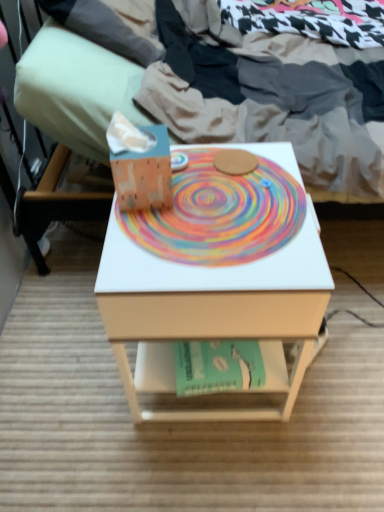
Locate an element on the screen. The width and height of the screenshot is (384, 512). free space in front of white matte desk at center is located at coordinates [x=222, y=467].